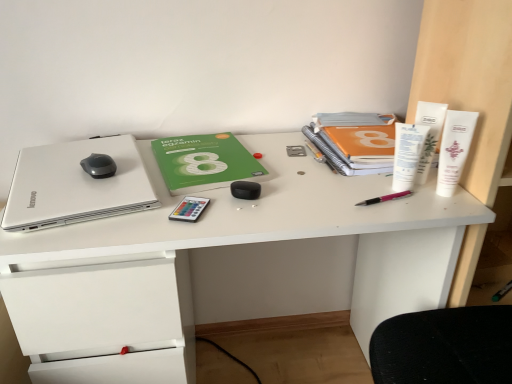
Image resolution: width=512 pixels, height=384 pixels. Find the location of `vacant space behind black plastic remote control at center-left, the 1th stationery in the left-to-right sequence`. vacant space behind black plastic remote control at center-left, the 1th stationery in the left-to-right sequence is located at coordinates (206, 180).